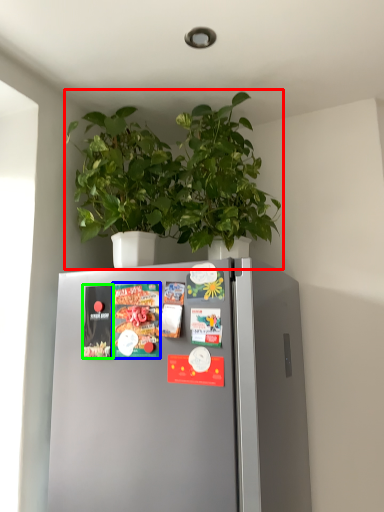
Question: Based on their relative distances, which object is nearer to houseplant (highlighted by a red box)? Choose from magazine (highlighted by a blue box) and magazine (highlighted by a green box).

Choices:
 (A) magazine
 (B) magazine

Answer: (A)